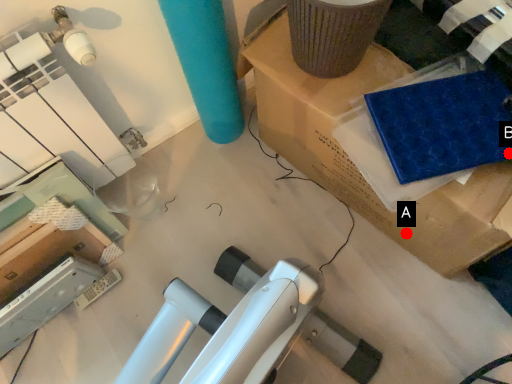
Question: Two points are circled on the image, labeled by A and B beside each circle. Which point is further to the camera?

Choices:
 (A) A is further
 (B) B is further

Answer: (A)